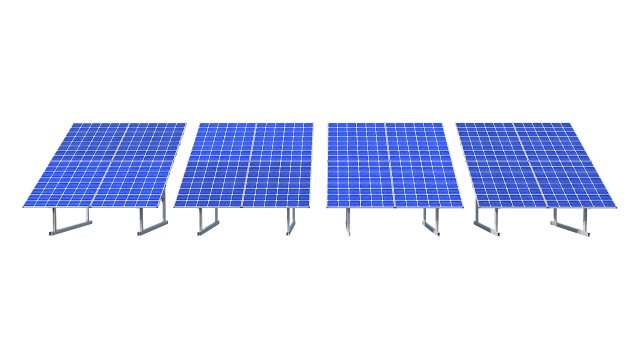
Find the location of `far right corner`. far right corner is located at coordinates (614, 206).